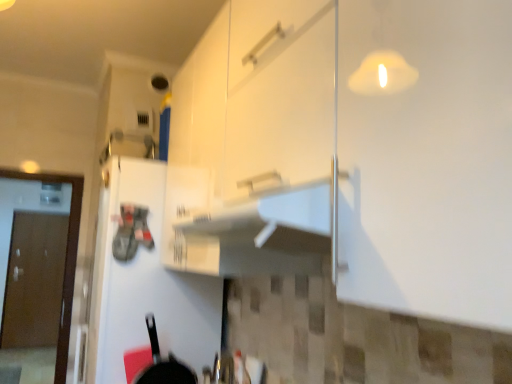
Question: Is brown matte door at left, which ranks as the 2th door in right-to-left order, to the left of black matte frying pan at lower left from the viewer's perspective?

Choices:
 (A) yes
 (B) no

Answer: (A)

Question: Is the position of brown matte door at left, which is counted as the 1th door, starting from the back, less distant than that of black matte frying pan at lower left?

Choices:
 (A) yes
 (B) no

Answer: (B)

Question: Does brown matte door at left, which is counted as the 1th door, starting from the back, have a lesser height compared to black matte frying pan at lower left?

Choices:
 (A) no
 (B) yes

Answer: (A)

Question: From the image's perspective, is brown matte door at left, which ranks as the 2th door in right-to-left order, on top of black matte frying pan at lower left?

Choices:
 (A) no
 (B) yes

Answer: (A)

Question: Could you tell me if brown matte door at left, which is the 2th door in front-to-back order, is turned towards black matte frying pan at lower left?

Choices:
 (A) no
 (B) yes

Answer: (B)

Question: Does brown matte door at left, which is counted as the 1th door, starting from the back, have a smaller size compared to black matte frying pan at lower left?

Choices:
 (A) yes
 (B) no

Answer: (B)

Question: Considering the relative sizes of white matte refrigerator at left, which is the 1th door in front-to-back order, and brown matte door at left, placed as the first door when sorted from left to right, in the image provided, is white matte refrigerator at left, which is the 1th door in front-to-back order, taller than brown matte door at left, placed as the first door when sorted from left to right,?

Choices:
 (A) yes
 (B) no

Answer: (B)

Question: Is white matte refrigerator at left, positioned as the first door in right-to-left order, in front of brown matte door at left, which ranks as the 2th door in right-to-left order?

Choices:
 (A) no
 (B) yes

Answer: (B)

Question: Considering the relative positions of white matte refrigerator at left, acting as the 2th door starting from the left, and brown matte door at left, which ranks as the 2th door in right-to-left order, in the image provided, is white matte refrigerator at left, acting as the 2th door starting from the left, behind brown matte door at left, which ranks as the 2th door in right-to-left order,?

Choices:
 (A) yes
 (B) no

Answer: (B)

Question: From a real-world perspective, is white matte refrigerator at left, which is the 1th door in front-to-back order, located higher than brown matte door at left, which is counted as the 1th door, starting from the back?

Choices:
 (A) no
 (B) yes

Answer: (B)

Question: Is brown matte door at left, placed as the first door when sorted from left to right, surrounded by white matte refrigerator at left, which is the 1th door in front-to-back order?

Choices:
 (A) no
 (B) yes

Answer: (A)

Question: From a real-world perspective, is white matte refrigerator at left, which is the 1th door in front-to-back order, physically below brown matte door at left, which is counted as the 1th door, starting from the back?

Choices:
 (A) no
 (B) yes

Answer: (A)

Question: Is black matte frying pan at lower left at the back of white matte refrigerator at left, the 2th door positioned from the back?

Choices:
 (A) no
 (B) yes

Answer: (A)